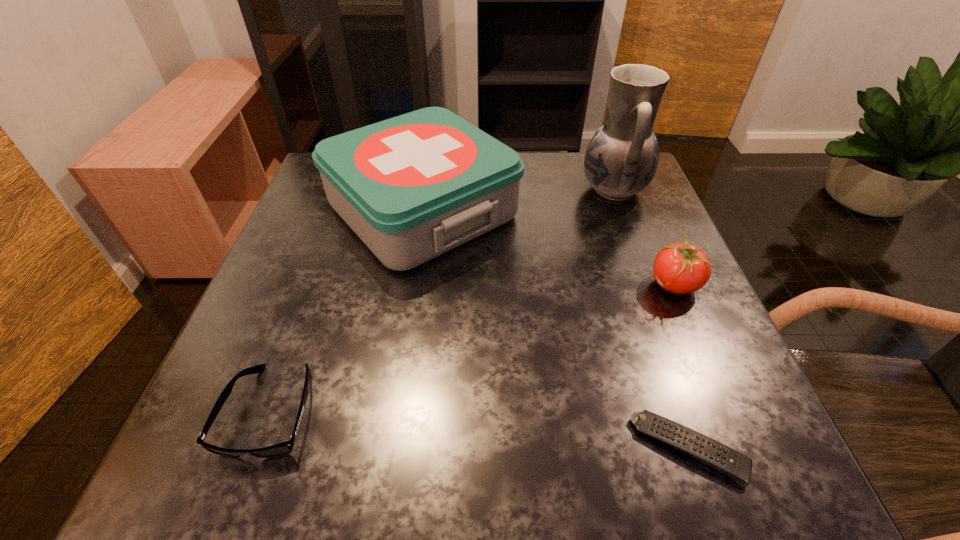
At what (x,y) coordinates should I click in order to perform the action: click on vacant space at the near right corner of the desktop. Please return your answer as a coordinate pair (x, y). This screenshot has height=540, width=960. Looking at the image, I should click on (680, 457).

Where is `vacant area that lies between the third tallest object and the fourth tallest object`? This screenshot has width=960, height=540. vacant area that lies between the third tallest object and the fourth tallest object is located at coordinates (472, 348).

You are a GUI agent. You are given a task and a screenshot of the screen. Output one action in this format:
    pyautogui.click(x=<x>, y=<y>)
    Task: Click on the free point between the fourth tallest object and the shortest object
    This screenshot has height=540, width=960.
    Given the screenshot: What is the action you would take?
    pyautogui.click(x=480, y=430)

Where is `free area in between the sunglasses and the pitcher`? The height and width of the screenshot is (540, 960). free area in between the sunglasses and the pitcher is located at coordinates (442, 300).

Find the location of a particular element. vacant space that is in between the remote control and the tallest object is located at coordinates (652, 319).

This screenshot has width=960, height=540. In order to click on empty space that is in between the tallest object and the second shortest object in this screenshot , I will do `click(442, 300)`.

At what (x,y) coordinates should I click in order to perform the action: click on unoccupied position between the first-aid kit and the third tallest object. Please return your answer as a coordinate pair (x, y). This screenshot has width=960, height=540. Looking at the image, I should click on (548, 247).

Where is `empty location between the fourth tallest object and the remote control`? empty location between the fourth tallest object and the remote control is located at coordinates (480, 430).

I want to click on vacant space in between the third tallest object and the first-aid kit, so click(x=548, y=247).

Find the location of a particular element. The width and height of the screenshot is (960, 540). vacant area that lies between the tallest object and the tomato is located at coordinates (643, 237).